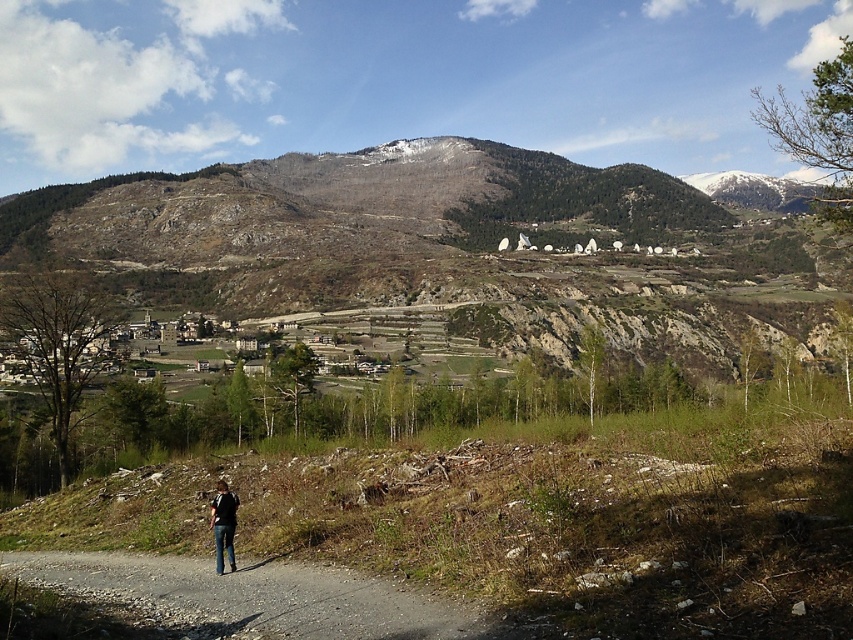
You are standing at the base of the mountain and see two points marked in the image. Which point, point (283, 612) or point (227, 536), is closer to you?

Point (283, 612) is closer to the viewer than point (227, 536).

You are a hiker standing at the base of the mountain. You see a gray gravel path at lower left and a denim jacket at lower left. Which object is positioned to the right of the other?

The gray gravel path at lower left is to the right of the denim jacket at lower left.